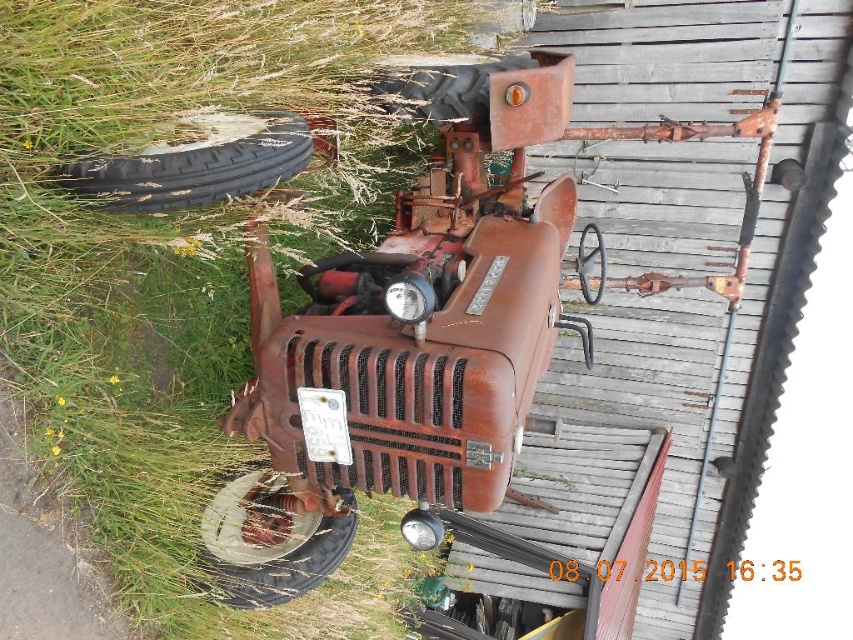
You are standing in front of the old tractor and looking at two points marked on its body. The first point is at coordinate point (254, 570) and the second is at point (461, 65). Which point is closer to your eyes?

Point (254, 570) is closer to the camera than point (461, 65), so the first point is closer to your eyes.

You are standing in the field and see the green grass at upper left and the black rubber tire at left. Which object is closer to you?

The green grass at upper left is closer to you because it is in front of the black rubber tire at left.

You are a gardener trying to mow the lawn. You see the green grass at upper left and the rusty metal tire at center. Which area should you prioritize mowing first, and why?

You should prioritize mowing the green grass at upper left first because it is larger in size than the rusty metal tire at center, indicating it requires more attention.